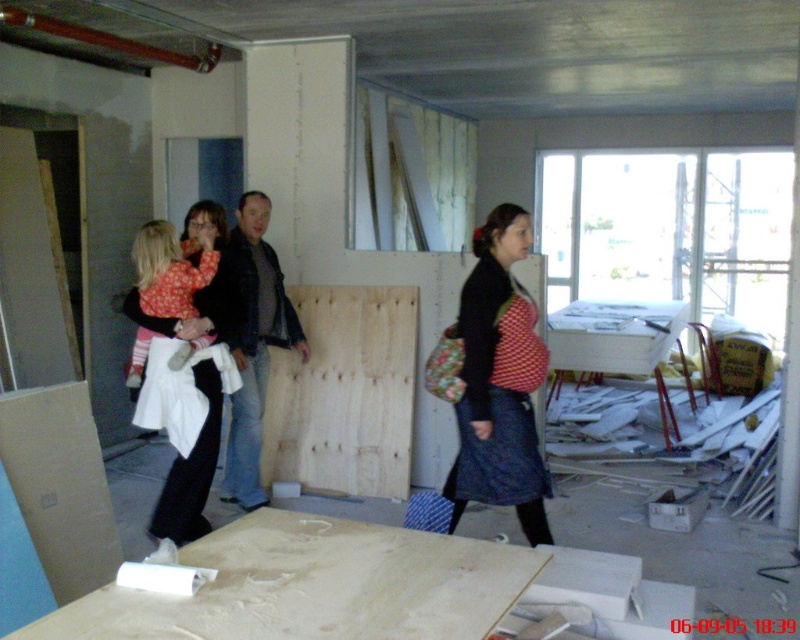
Question: Which of the following is the farthest from the observer?

Choices:
 (A) (386, 410)
 (B) (533, 538)
 (C) (222, 486)

Answer: (A)

Question: Which point appears closest to the camera in this image?

Choices:
 (A) pyautogui.click(x=392, y=406)
 (B) pyautogui.click(x=233, y=236)
 (C) pyautogui.click(x=192, y=342)

Answer: (C)

Question: Is light brown smooth plywood at lower center bigger than red dotted dress at center?

Choices:
 (A) no
 (B) yes

Answer: (A)

Question: Can you confirm if light brown smooth plywood at lower center is smaller than red dotted dress at center?

Choices:
 (A) no
 (B) yes

Answer: (B)

Question: Estimate the real-world distances between objects in this image. Which object is farther from the light brown wood at center?

Choices:
 (A) light brown smooth plywood at lower center
 (B) black leather jacket at center

Answer: (A)

Question: Is light brown smooth plywood at lower center wider than light brown wood at center?

Choices:
 (A) no
 (B) yes

Answer: (B)